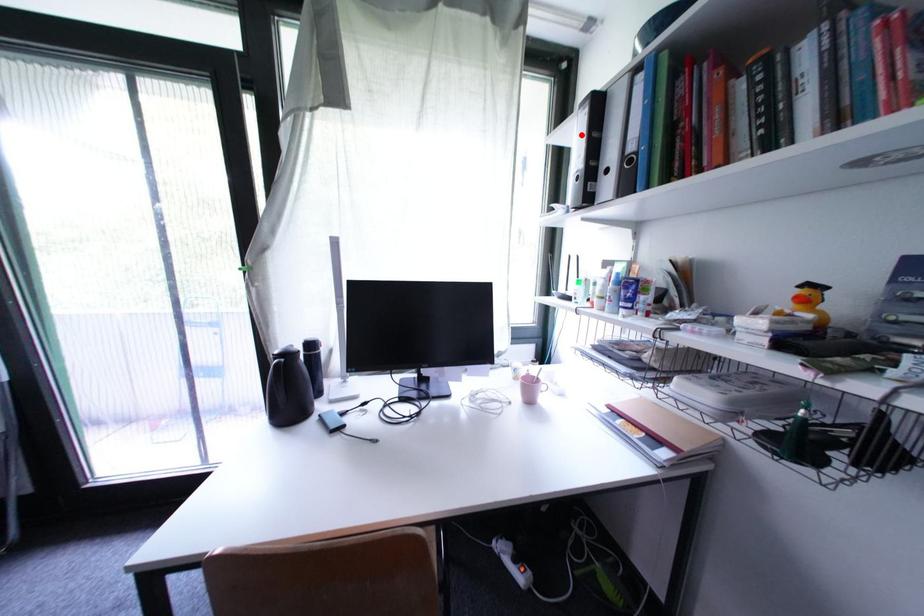
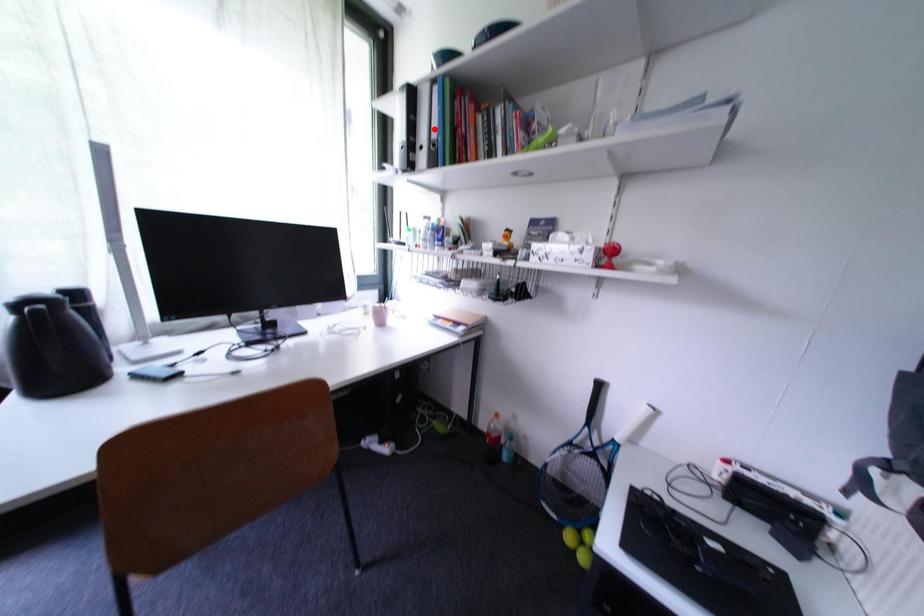
I am providing you with two images of the same scene from different viewpoints. A red point is marked on the first image and another point is marked on the second image. Is the red point in image1 aligned with the point shown in image2?

No